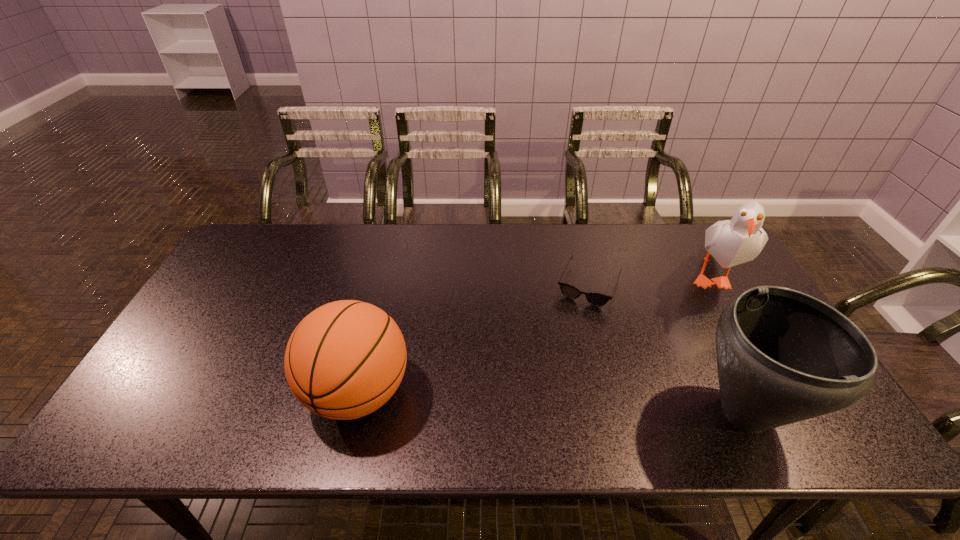
This screenshot has height=540, width=960. I want to click on vacant space located 0.330m at the beak of the gull, so click(x=636, y=360).

Find the location of a particular element. vacant space situated 0.260m at the beak of the gull is located at coordinates (651, 347).

The width and height of the screenshot is (960, 540). In order to click on free space located at the beak of the gull in this screenshot , I will do `click(651, 347)`.

What are the coordinates of `sunglasses that is at the far edge` in the screenshot? It's located at (596, 299).

This screenshot has height=540, width=960. Find the location of `gull situated at the far edge`. gull situated at the far edge is located at coordinates (732, 242).

Find the location of a particular element. Image resolution: width=960 pixels, height=540 pixels. basketball situated at the near edge is located at coordinates (x=346, y=359).

Where is `urn that is positioned at the near edge`? urn that is positioned at the near edge is located at coordinates (783, 356).

This screenshot has height=540, width=960. What are the coordinates of `urn located at the right edge` in the screenshot? It's located at (783, 356).

Identify the location of gull at the right edge. (732, 242).

You are a GUI agent. You are given a task and a screenshot of the screen. Output one action in this format:
    pyautogui.click(x=<x>, y=<y>)
    Task: Click on the object that is at the far right corner
    The height and width of the screenshot is (540, 960).
    Given the screenshot: What is the action you would take?
    coord(732,242)